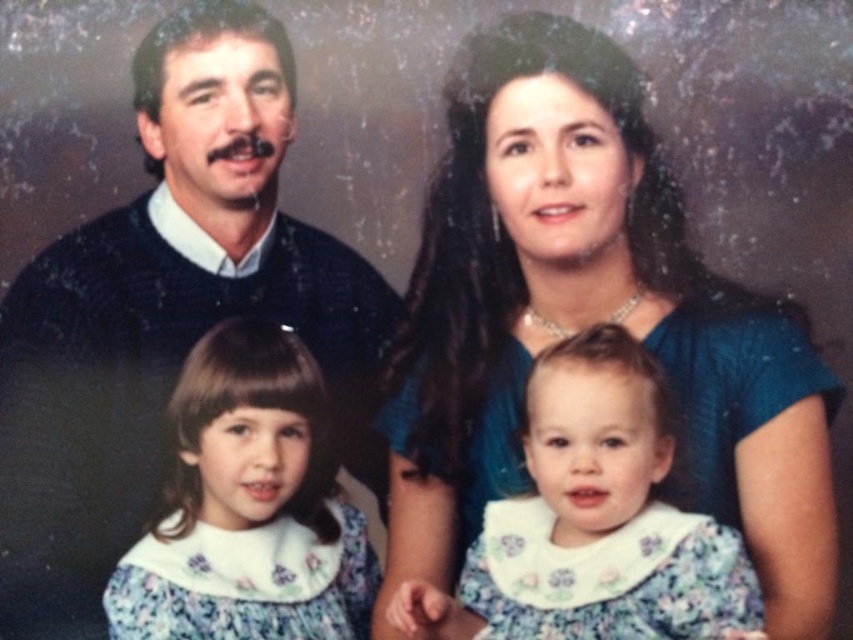
Between knitted sweater at upper left and floral fabric dress at lower left, which one appears on the right side from the viewer's perspective?

From the viewer's perspective, floral fabric dress at lower left appears more on the right side.

Is point (41, 433) closer to camera compared to point (270, 600)?

No, (41, 433) is further to viewer.

Does point (235, 60) come behind point (189, 620)?

Yes.

The width and height of the screenshot is (853, 640). What are the coordinates of `knitted sweater at upper left` in the screenshot? It's located at (164, 310).

Is blue satin dress at upper center wider than floral fabric dress at center?

Yes.

Is blue satin dress at upper center to the right of floral fabric dress at center from the viewer's perspective?

No, blue satin dress at upper center is not to the right of floral fabric dress at center.

Identify the location of blue satin dress at upper center. This screenshot has height=640, width=853. (590, 320).

Can you confirm if floral fabric dress at center is smaller than floral fabric dress at lower left?

Yes.

Between floral fabric dress at center and floral fabric dress at lower left, which one is positioned higher?

Positioned higher is floral fabric dress at lower left.

Locate an element on the screen. This screenshot has width=853, height=640. floral fabric dress at center is located at coordinates (593, 522).